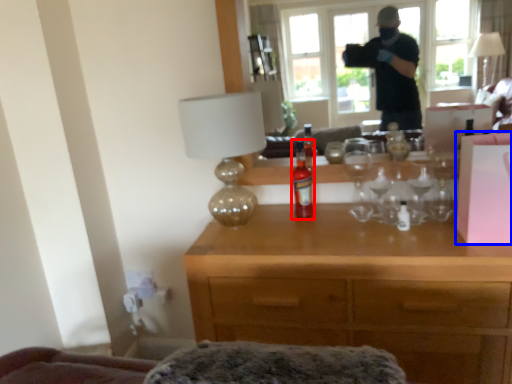
Question: Which object appears farthest to the camera in this image, bottle (highlighted by a red box) or box (highlighted by a blue box)?

Choices:
 (A) bottle
 (B) box

Answer: (A)